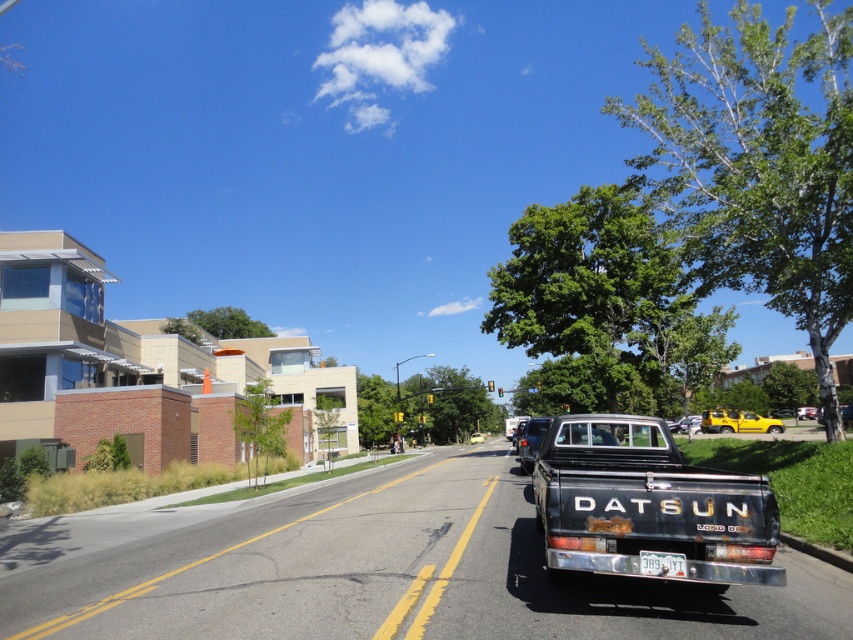
You are standing at the origin point of the image coordinate system, which is the bottom left corner. You want to locate the rusty black truck at center. What are its coordinates?

The coordinates of the rusty black truck at center are at point (x=647, y=504).

You are a delivery driver who needs to park your metallic silver truck at center and matte black truck at center in a parking lot with limited space. Which truck should you park first to maximize space efficiency?

You should park the matte black truck at center first because it is smaller than the metallic silver truck at center, allowing for better space utilization.

You are a pedestrian standing on the sidewalk and looking at the rusty black truck at center and the white plastic license plate at center. Which object is nearer to you?

The rusty black truck at center is closer to the viewer than the white plastic license plate at center, so the rusty black truck at center is nearer to you.